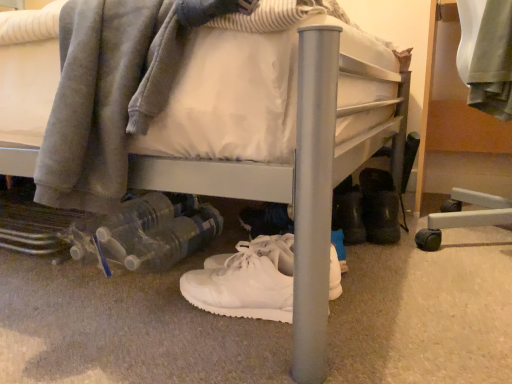
Question: Considering the relative sizes of brushed metal bed frame at right and white leather sneakers at center, the 2th footwear viewed from the top, in the image provided, is brushed metal bed frame at right taller than white leather sneakers at center, the 2th footwear viewed from the top,?

Choices:
 (A) yes
 (B) no

Answer: (A)

Question: Is brushed metal bed frame at right oriented towards white leather sneakers at center, the 2th footwear viewed from the top?

Choices:
 (A) yes
 (B) no

Answer: (B)

Question: Are brushed metal bed frame at right and white leather sneakers at center, the second footwear from the back, beside each other?

Choices:
 (A) no
 (B) yes

Answer: (A)

Question: Does brushed metal bed frame at right have a lesser height compared to white leather sneakers at center, the first footwear in the bottom-to-top sequence?

Choices:
 (A) yes
 (B) no

Answer: (B)

Question: From a real-world perspective, is brushed metal bed frame at right on white leather sneakers at center, the 2th footwear viewed from the top?

Choices:
 (A) no
 (B) yes

Answer: (B)

Question: In the image, is white leather sneakers at center, the first footwear in the bottom-to-top sequence, positioned in front of or behind black rubber boots at lower right, marked as the 2th footwear in a bottom-to-top arrangement?

Choices:
 (A) behind
 (B) front

Answer: (B)

Question: Visually, is white leather sneakers at center, the first footwear in the bottom-to-top sequence, positioned to the left or to the right of black rubber boots at lower right, the first footwear from the back?

Choices:
 (A) right
 (B) left

Answer: (B)

Question: Is point (225, 274) closer or farther from the camera than point (366, 235)?

Choices:
 (A) closer
 (B) farther

Answer: (A)

Question: Which is correct: white leather sneakers at center, which ranks as the 1th footwear in front-to-back order, is inside black rubber boots at lower right, positioned as the 2th footwear in front-to-back order, or outside of it?

Choices:
 (A) outside
 (B) inside

Answer: (A)

Question: Is white leather sneakers at center, positioned as the first footwear in left-to-right order, taller or shorter than brushed metal bed frame at right?

Choices:
 (A) tall
 (B) short

Answer: (B)

Question: In the image, is white leather sneakers at center, the first footwear in the bottom-to-top sequence, positioned in front of or behind brushed metal bed frame at right?

Choices:
 (A) front
 (B) behind

Answer: (A)

Question: Based on their positions, is white leather sneakers at center, the 2th footwear when ordered from right to left, located to the left or right of brushed metal bed frame at right?

Choices:
 (A) right
 (B) left

Answer: (B)

Question: Looking at the image, does white leather sneakers at center, the 2th footwear viewed from the top, seem bigger or smaller compared to brushed metal bed frame at right?

Choices:
 (A) small
 (B) big

Answer: (A)

Question: Is brushed metal bed frame at right inside the boundaries of white leather sneakers at center, the 2th footwear viewed from the top, or outside?

Choices:
 (A) outside
 (B) inside

Answer: (A)

Question: From their relative heights in the image, would you say brushed metal bed frame at right is taller or shorter than white leather sneakers at center, the first footwear in the bottom-to-top sequence?

Choices:
 (A) short
 (B) tall

Answer: (B)